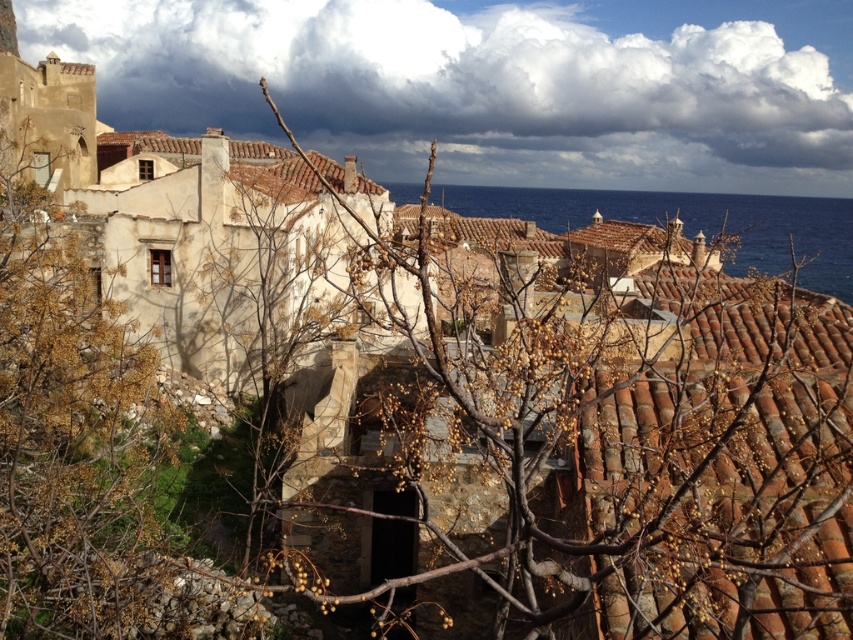
Question: Which of the following is the farthest from the observer?

Choices:
 (A) blue water at center
 (B) brown tile roof at center

Answer: (A)

Question: Which is nearer to the brown tile roof at upper left?

Choices:
 (A) brown tile roof at center
 (B) blue water at center

Answer: (A)

Question: Is brown tile roof at center to the left of brown tile roof at upper left from the viewer's perspective?

Choices:
 (A) yes
 (B) no

Answer: (B)

Question: From the image, what is the correct spatial relationship of brown tile roof at center in relation to brown tile roof at upper left?

Choices:
 (A) above
 (B) below

Answer: (B)

Question: Which object is closer to the camera taking this photo?

Choices:
 (A) blue water at center
 (B) brown tile roof at center

Answer: (B)

Question: Does blue water at center appear on the left side of brown tile roof at upper left?

Choices:
 (A) no
 (B) yes

Answer: (A)